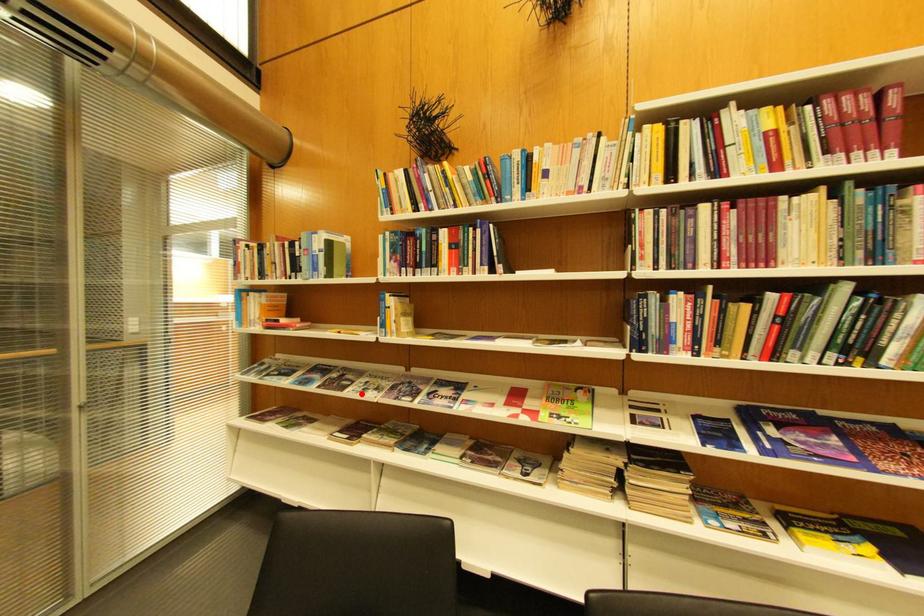
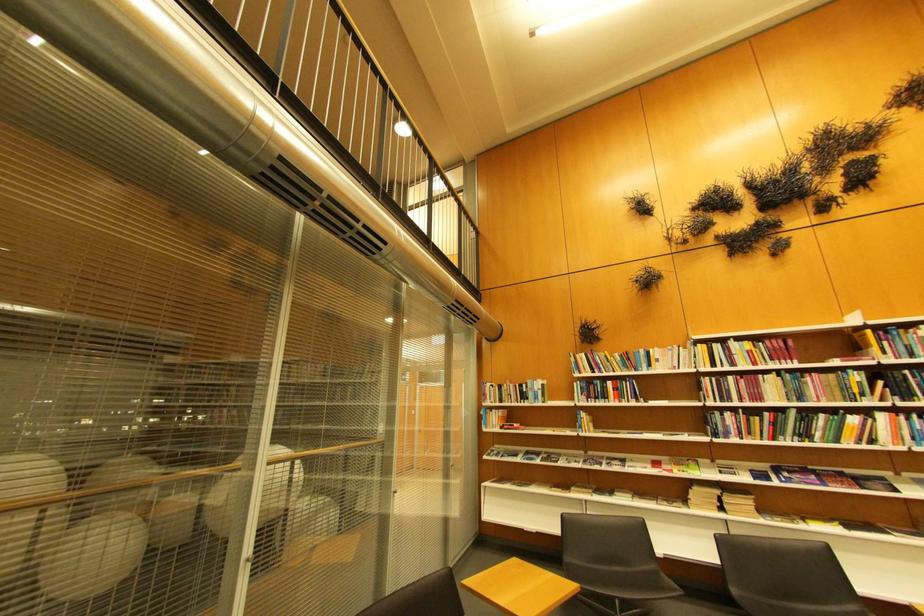
Locate, in the second image, the point that corresponds to the highlighted location in the first image.

(572, 464)